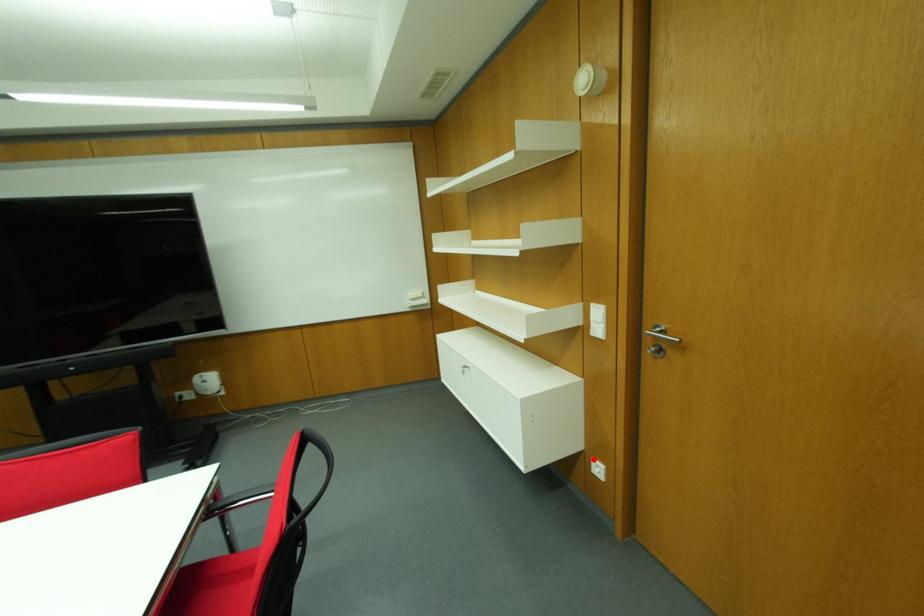
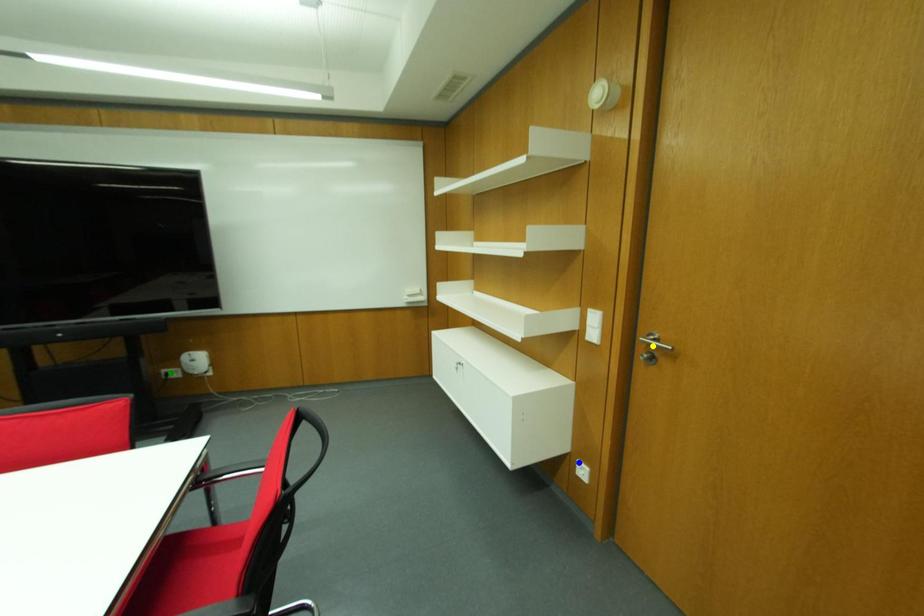
Question: I am providing you with two images of the same scene from different viewpoints. A red point is marked on the first image. You are given multiple points on the second image. Which spot in image 2 lines up with the point in image 1?

Choices:
 (A) green point
 (B) blue point
 (C) yellow point

Answer: (B)